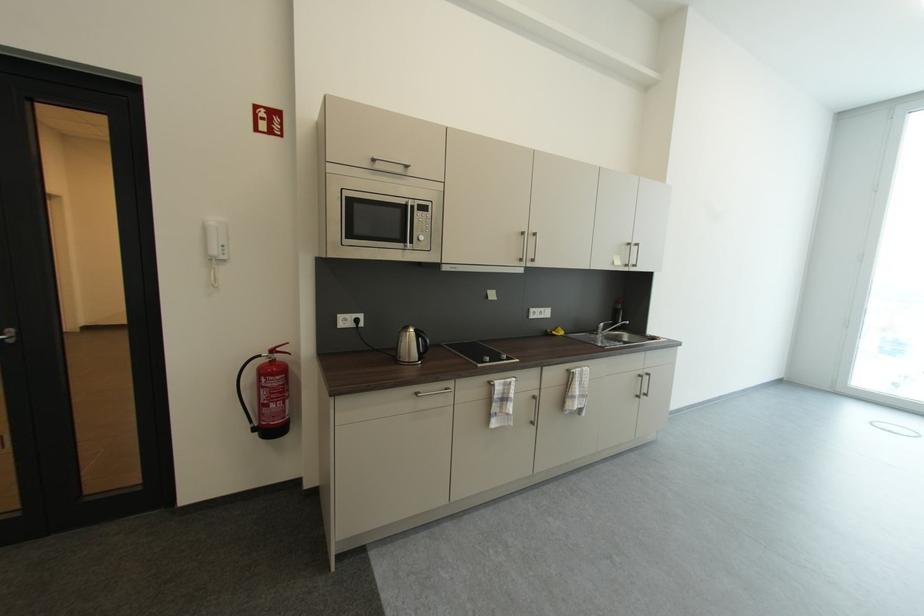
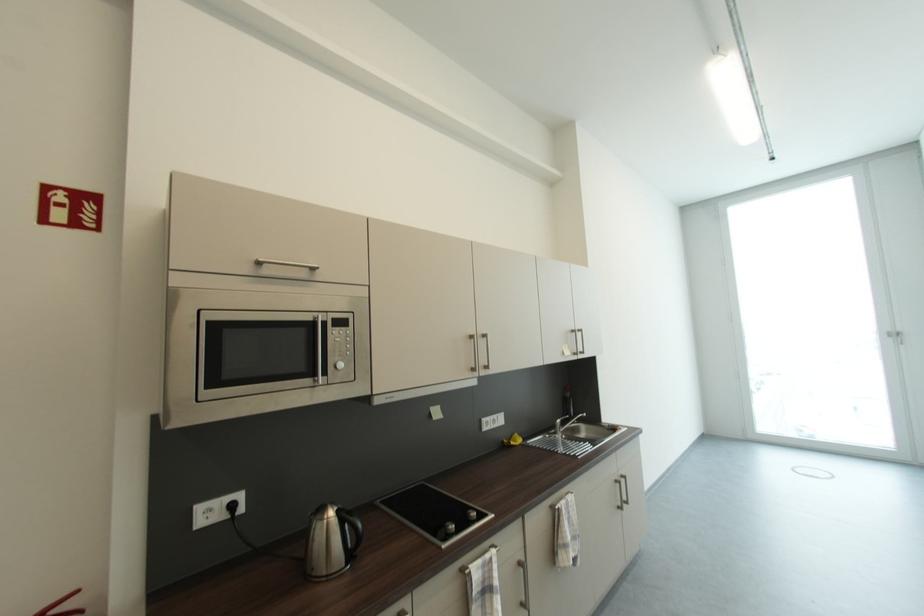
Question: The camera is either moving clockwise (left) or counter-clockwise (right) around the object. The first image is from the beginning of the video and the second image is from the end. Is the camera moving left or right when shooting the video?

Choices:
 (A) Left
 (B) Right

Answer: (A)